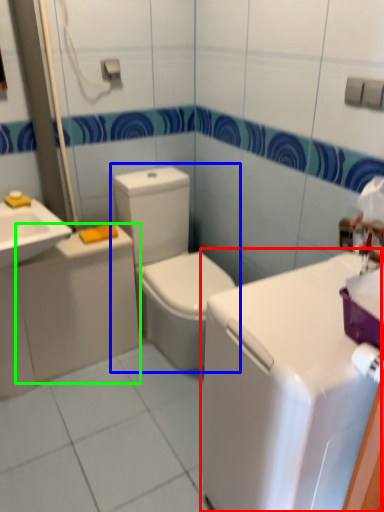
Question: Estimate the real-world distances between objects in this image. Which object is farther from counter top (highlighted by a red box), toilet (highlighted by a blue box) or appliance (highlighted by a green box)?

Choices:
 (A) toilet
 (B) appliance

Answer: (B)